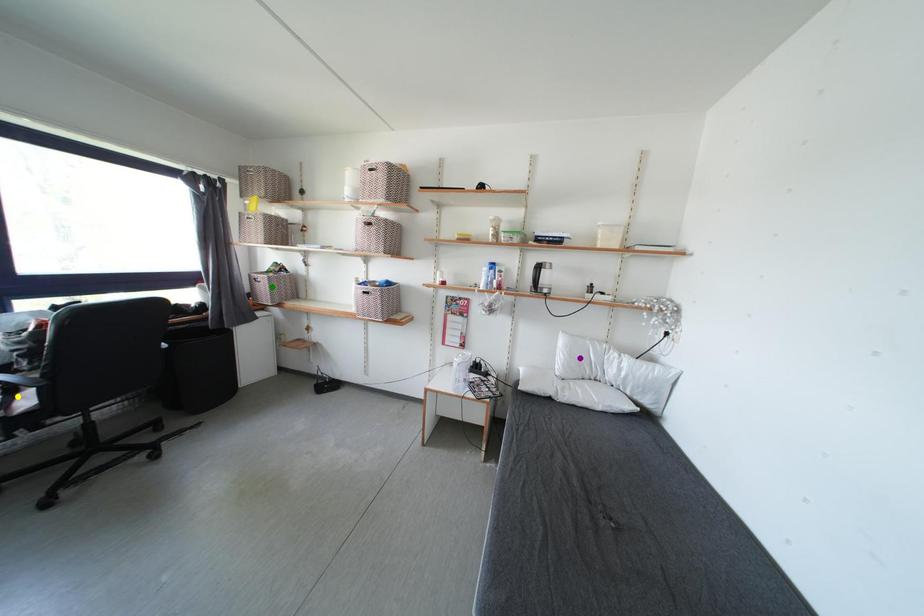
Order these from nearest to farthest:
purple point, green point, yellow point

yellow point < purple point < green point